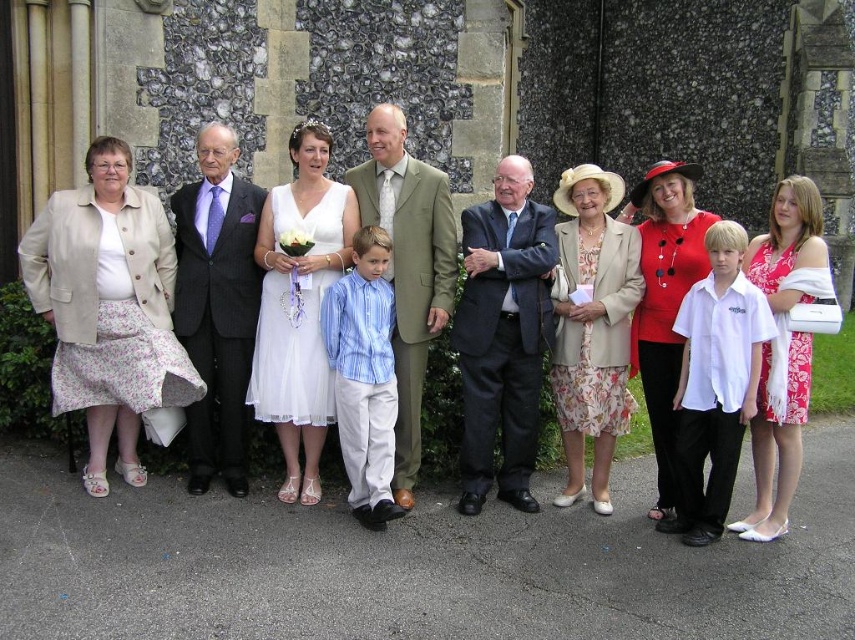
Is dark blue suit at center wider than floral print dress at center?

Yes, dark blue suit at center is wider than floral print dress at center.

Between point (513, 292) and point (621, 332), which one is positioned in front?

Positioned in front is point (513, 292).

Where is `dark blue suit at center`? The height and width of the screenshot is (640, 855). dark blue suit at center is located at coordinates click(x=503, y=333).

In the scene shown: Which of these two, dark blue suit at center or dark gray pinstripe suit at center, stands shorter?

dark blue suit at center is shorter.

Can you confirm if dark blue suit at center is smaller than dark gray pinstripe suit at center?

Incorrect, dark blue suit at center is not smaller in size than dark gray pinstripe suit at center.

Does point (523, 179) come behind point (240, 364)?

No, it is in front of (240, 364).

Where is `dark blue suit at center`? This screenshot has width=855, height=640. dark blue suit at center is located at coordinates (503, 333).

Is floral cotton skirt at left below dark blue suit at center?

Incorrect, floral cotton skirt at left is not positioned below dark blue suit at center.

Consider the image. Can you confirm if floral cotton skirt at left is smaller than dark blue suit at center?

Yes.

Is point (86, 156) positioned behind point (510, 417)?

Yes, point (86, 156) is behind point (510, 417).

This screenshot has width=855, height=640. In order to click on floral cotton skirt at left in this screenshot , I will do `click(108, 307)`.